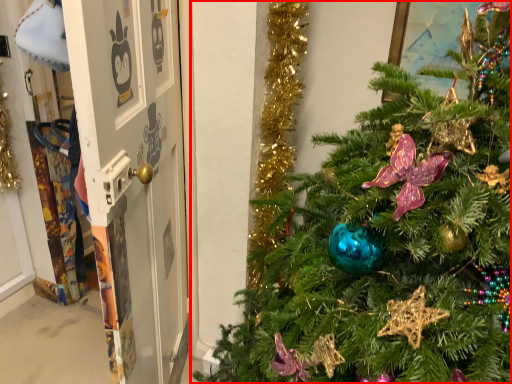
Question: From the image's perspective, where is christmas tree (annotated by the red box) located in relation to screen door in the image?

Choices:
 (A) below
 (B) above

Answer: (A)